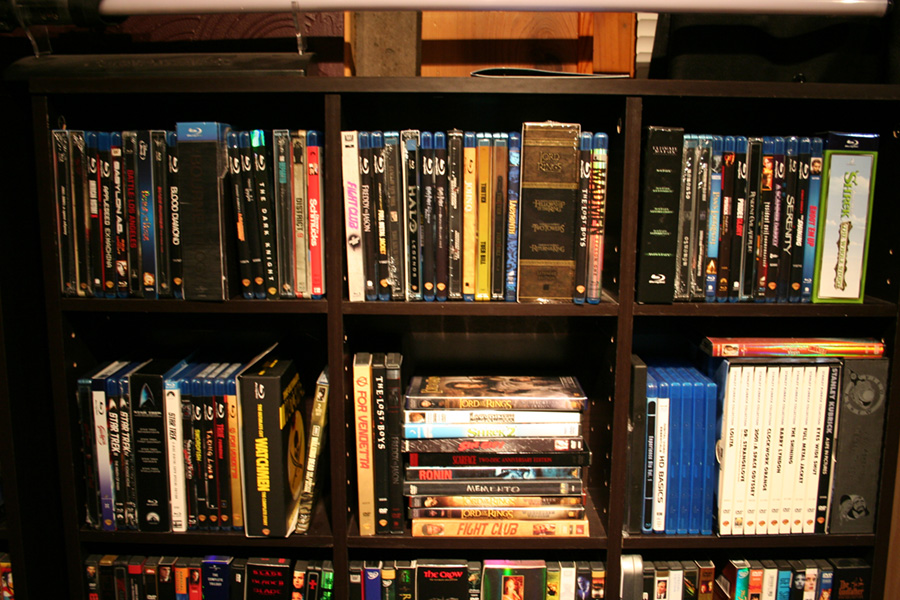
Locate an element on the screen. compartments in a book shelf is located at coordinates (210, 221), (466, 218), (756, 223), (777, 431), (514, 429), (231, 434), (229, 584), (482, 585), (770, 583).